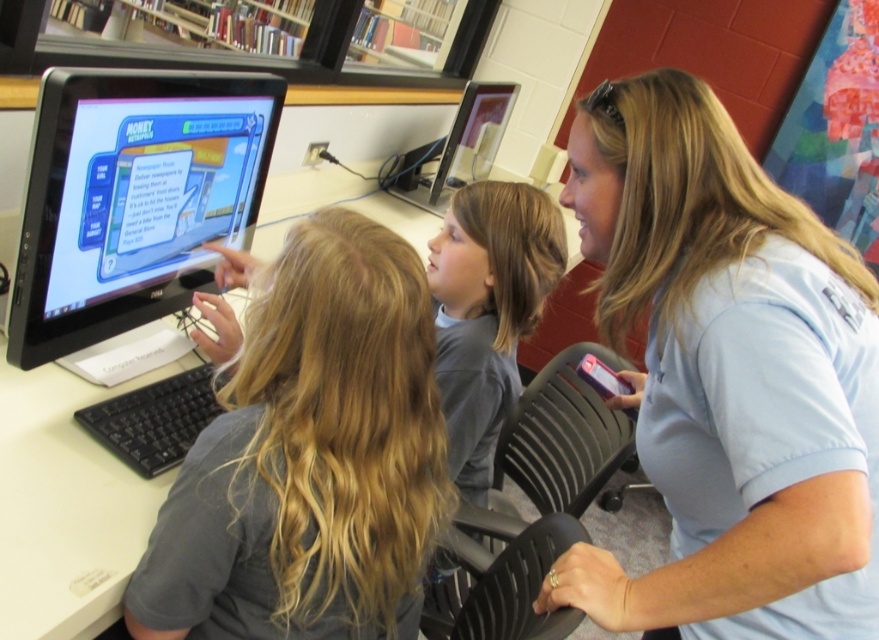
Question: In this image, where is light blue shirt at center located relative to matte black monitor at upper center?

Choices:
 (A) below
 (B) above

Answer: (A)

Question: Among these points, which one is nearest to the camera?

Choices:
 (A) (706, 524)
 (B) (180, 204)
 (C) (482, 113)

Answer: (A)

Question: Among these objects, which one is farthest from the camera?

Choices:
 (A) matte black monitor at left
 (B) gray matte shirt at center
 (C) light blue shirt at center
 (D) gray shirt at center

Answer: (D)

Question: Observing the image, what is the correct spatial positioning of gray matte shirt at center in reference to matte black monitor at upper center?

Choices:
 (A) below
 (B) above

Answer: (A)

Question: Which object appears closest to the camera in this image?

Choices:
 (A) light blue shirt at center
 (B) gray shirt at center
 (C) matte black monitor at left
 (D) gray matte shirt at center

Answer: (A)

Question: Is light blue shirt at center positioned in front of matte black monitor at upper center?

Choices:
 (A) no
 (B) yes

Answer: (B)